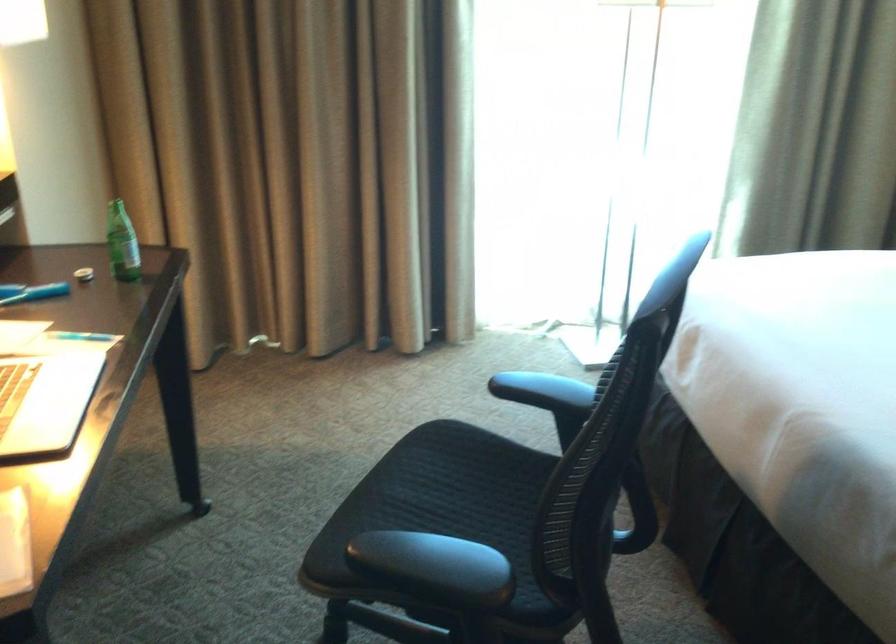
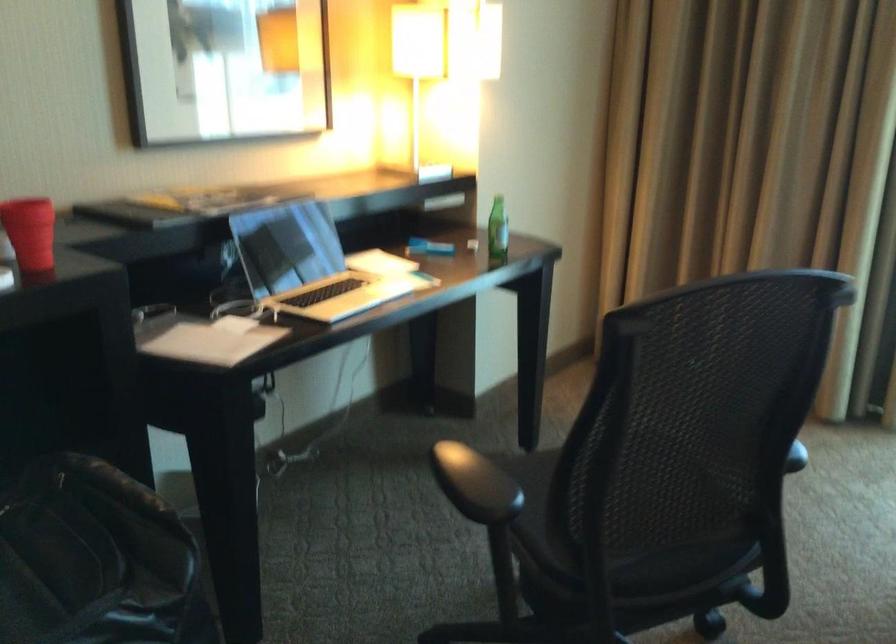
Find the pixel in the second image that matches (535,522) in the first image.

(558, 480)